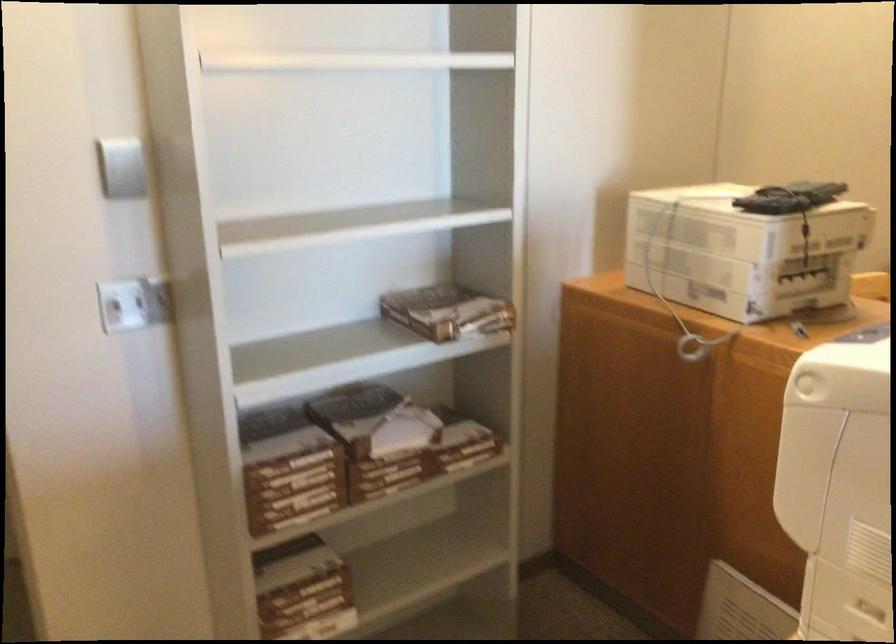
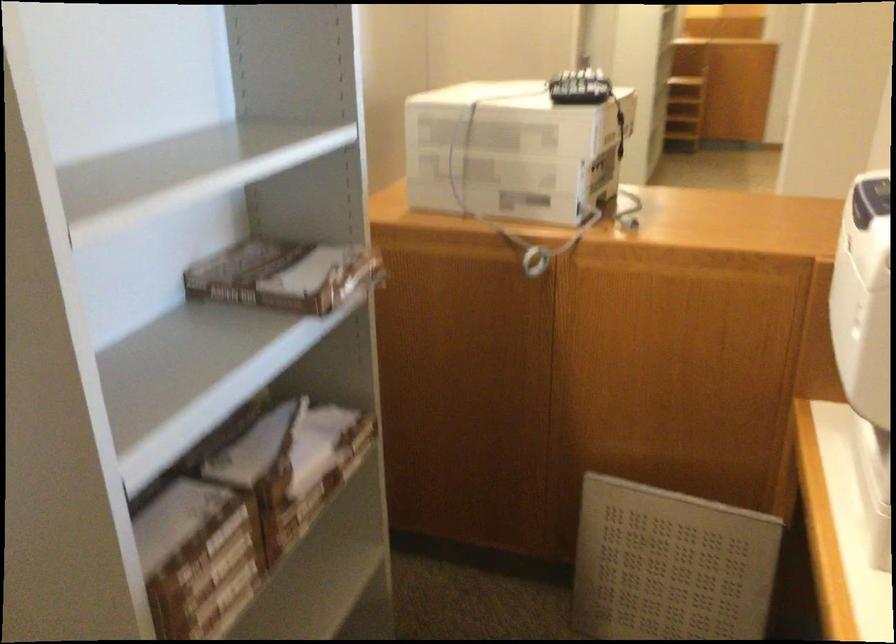
Where in the second image is the point corresponding to (294,473) from the first image?

(209, 556)